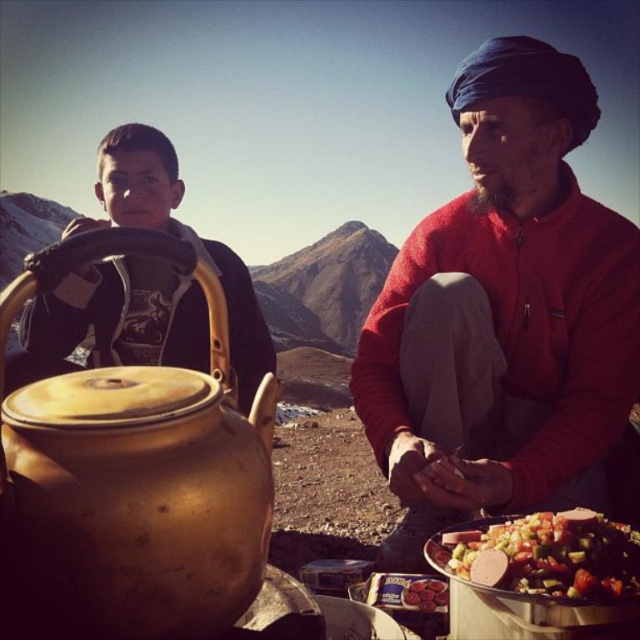
You are a photographer wanting to capture both the red wool sweater at center and the shiny metallic bowl at lower right in the same frame. Which object should you focus on first to ensure both are in focus, considering their sizes?

The red wool sweater at center has a greater height compared to the shiny metallic bowl at lower right. Therefore, you should focus on the red wool sweater at center first since it is larger and requires more attention to ensure both are in focus.

You are planning to take a photo of the red wool sweater at center in the scene. Based on its position, where should you aim your camera to capture it?

The red wool sweater at center is located at point coordinates (504, 314), so you should aim your camera at those coordinates to capture it accurately.

You are planning to set up a picnic in this scene. You need to place a picnic basket between the red wool sweater at center and the matte black jacket at left. Given that the basket is 0.5 meters wide, will there be enough space between them to fit the basket?

The red wool sweater at center and matte black jacket at left are 6.54 meters apart, so yes, there is enough space to place the picnic basket between them since the distance is much larger than the basket width of 0.5 meters.